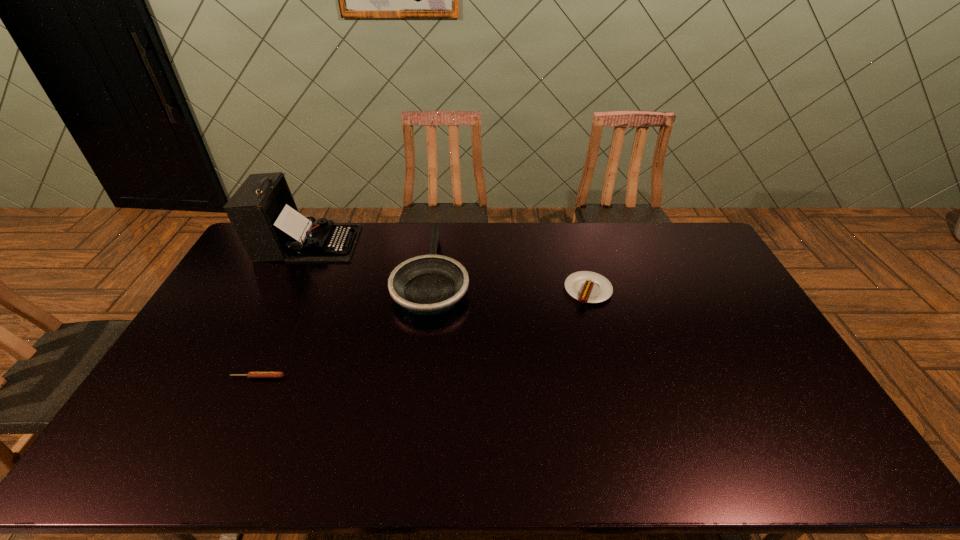
Where is `the tallest object`? the tallest object is located at coordinates (262, 211).

Where is `frying pan`? This screenshot has height=540, width=960. frying pan is located at coordinates (431, 284).

Locate an element on the screen. The width and height of the screenshot is (960, 540). the second object from right to left is located at coordinates (431, 284).

I want to click on the third tallest object, so click(x=588, y=287).

In order to click on the farther sausage in this screenshot , I will do `click(588, 287)`.

This screenshot has height=540, width=960. Find the location of `the left sausage`. the left sausage is located at coordinates (251, 374).

Locate an element on the screen. The width and height of the screenshot is (960, 540). the shortest object is located at coordinates (251, 374).

Find the location of `free spot located 0.320m inside the open case of the tallest object`. free spot located 0.320m inside the open case of the tallest object is located at coordinates (440, 244).

Find the location of a particular element. free space located 0.300m on the front of the right sausage is located at coordinates (613, 384).

This screenshot has height=540, width=960. I want to click on vacant space located on the right of the shortest object, so click(x=395, y=377).